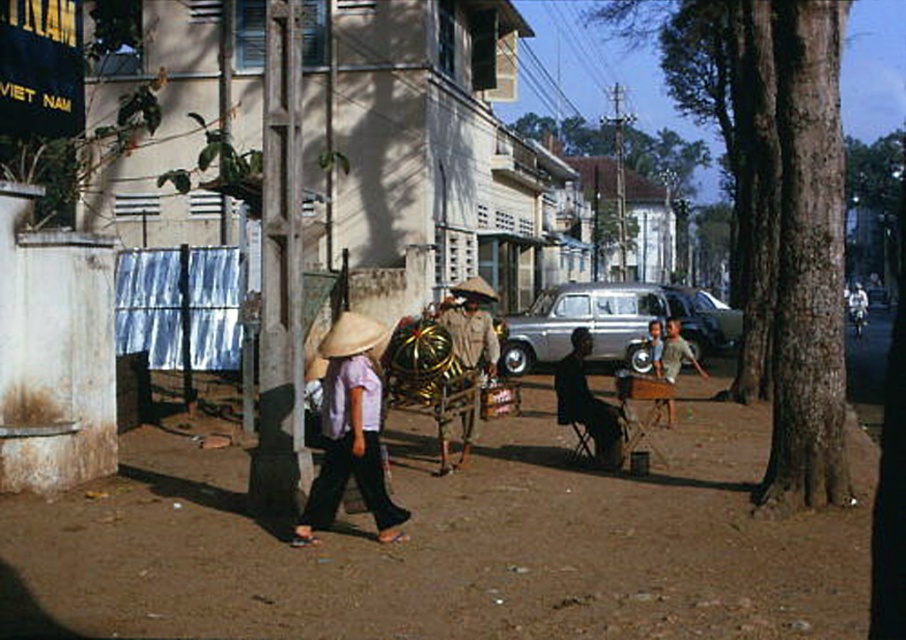
Question: Is light purple cotton shirt at center smaller than natural straw hat at center?

Choices:
 (A) no
 (B) yes

Answer: (B)

Question: Is brown dirt field at center in front of brown fabric cart at center?

Choices:
 (A) no
 (B) yes

Answer: (B)

Question: Estimate the real-world distances between objects in this image. Which object is farther from the light purple cotton shirt at center?

Choices:
 (A) brown fabric cart at center
 (B) brown dirt field at center
 (C) natural straw hat at center

Answer: (A)

Question: Does light purple cotton shirt at center have a smaller size compared to brown fabric cart at center?

Choices:
 (A) no
 (B) yes

Answer: (A)

Question: Considering the real-world distances, which object is closest to the silver metallic van at center?

Choices:
 (A) light purple cotton shirt at center
 (B) natural straw hat at center

Answer: (B)

Question: Estimate the real-world distances between objects in this image. Which object is farther from the silver metallic van at center?

Choices:
 (A) brown dirt field at center
 (B) brown fabric cart at center
 (C) light purple cotton shirt at center

Answer: (B)